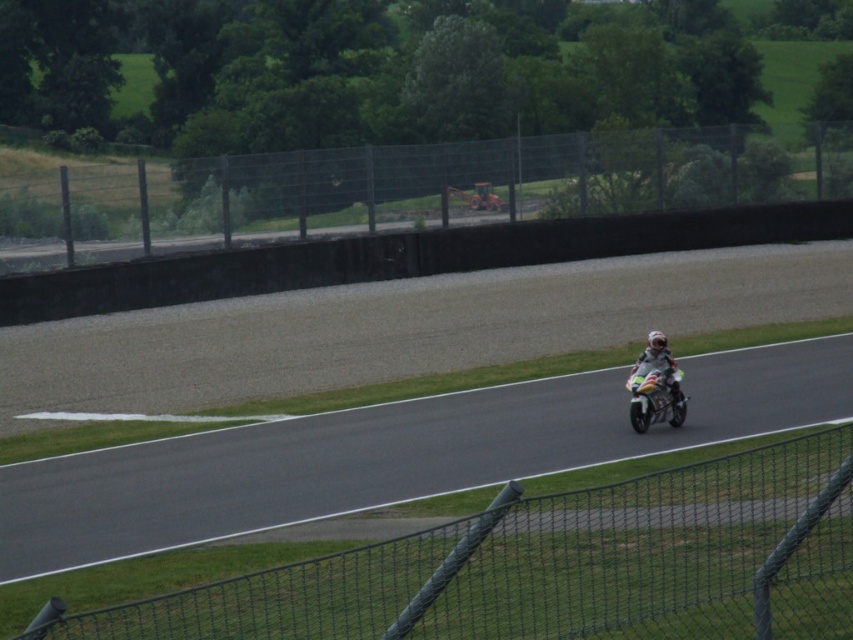
You are a drone operator trying to capture aerial footage of the racetrack. Your drone has a maximum flight range of 15 feet from its controller. You are currently positioned at the black mesh fence at lower right. Can you safely fly your drone to the concrete barrier beyond the fence without exceeding the drone range?

The distance between the black mesh fence at lower right and the concrete barrier beyond the fence is 17.38 feet. Since the drone has a maximum range of 15 feet, it cannot safely reach the concrete barrier without exceeding its range limit.

You are a photographer positioned at the edge of the racetrack. You want to take a photo of the shiny silver motorcycle at center without the black mesh fence at lower right appearing in the background. Based on their positions, is this possible?

The black mesh fence at lower right is in front of the shiny silver motorcycle at center, so the fence would block the view of the motorcycle. Therefore, it is not possible to take a photo of the shiny silver motorcycle at center without the black mesh fence at lower right appearing in the background.

You are a drone operator trying to capture aerial footage of the racetrack. Your drone has a maximum flight range of 100 feet from its starting position. If you position the drone above the black mesh fence at lower right, will it be able to fly to the metallic wire mesh fence at upper center without exceeding its range?

The black mesh fence at lower right and metallic wire mesh fence at upper center are 85.82 feet apart from each other. Since the drone has a maximum flight range of 100 feet, it can safely fly between them without exceeding its range.